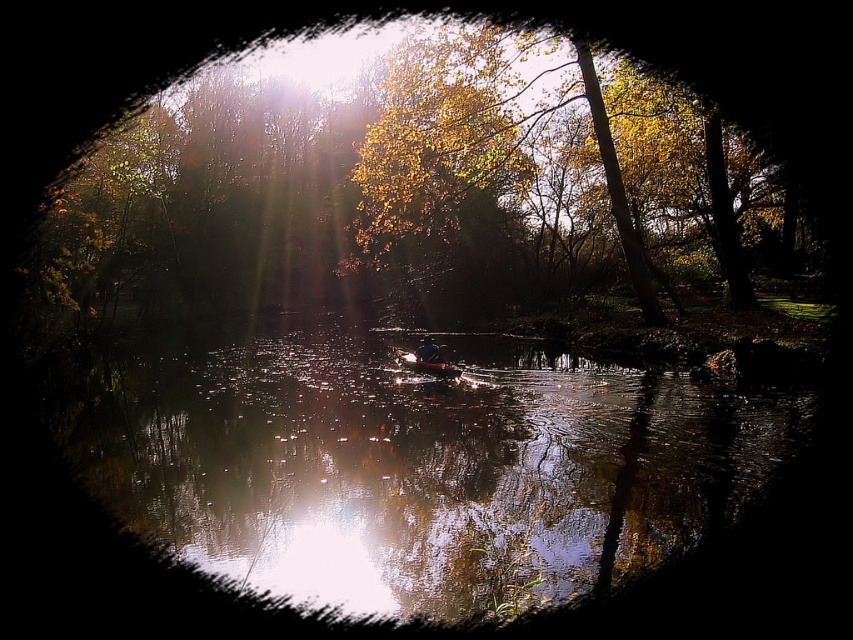
You are standing on the shore of the lake and want to throw a small stone into the water so that it skips across the surface. Considering the positions of the glossy reflective water at center and the yellow leafy tree at center, which object would allow the stone to travel a greater distance before hitting the opposite bank?

The yellow leafy tree at center has a greater width than the glossy reflective water at center, so the stone would travel a greater distance if thrown towards the yellow leafy tree at center.

You are a photographer trying to capture the kayaker in the center. Since the glossy reflective water at center and the yellow leafy tree at center are both in the frame, which object should you focus on to ensure the kayaker is sharp?

You should focus on the glossy reflective water at center because it is in front of the yellow leafy tree at center, so focusing on the closer object will keep the kayaker sharp.

You are a photographer standing on the dock and want to capture the kayaker in the glossy reflective water at center. The kayaker is currently 21.29 feet away from you. Your camera has a maximum focus range of 20 feet. Can you clearly capture the kayaker in the reflection?

The kayaker is 21.29 feet away from you, which exceeds your camera maximum focus range of 20 feet. Therefore, you cannot clearly capture the kayaker in the reflection.